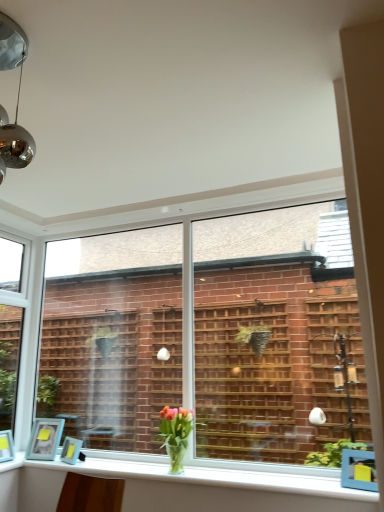
This screenshot has width=384, height=512. Describe the element at coordinates (12, 325) in the screenshot. I see `clear glass window at left, which appears as the 2th window when viewed from the right` at that location.

Describe the element at coordinates (180, 488) in the screenshot. I see `white glossy window sill at lower center` at that location.

In order to face matte blue picture frame at lower left, positioned as the second picture frame in right-to-left order, should I rotate leftwards or rightwards?

You should rotate left by 18.975 degrees.

The image size is (384, 512). Identify the location of matte blue picture frame at lower left, positioned as the 1th picture frame in right-to-left order. (71, 450).

Which of these two, matte blue picture frame at lower left, positioned as the 1th picture frame in right-to-left order, or translucent glass vase at lower center, is thinner?

With smaller width is matte blue picture frame at lower left, positioned as the 1th picture frame in right-to-left order.

Based on the photo, from a real-world perspective, between matte blue picture frame at lower left, positioned as the 1th picture frame in right-to-left order, and translucent glass vase at lower center, who is vertically lower?

matte blue picture frame at lower left, positioned as the 1th picture frame in right-to-left order, is physically lower.

Is the surface of matte blue picture frame at lower left, the 2th picture frame when ordered from left to right, in direct contact with translucent glass vase at lower center?

No, matte blue picture frame at lower left, the 2th picture frame when ordered from left to right, is not next to translucent glass vase at lower center.

Looking at this image, is translucent glass vase at lower center at the back of matte blue picture frame at lower left, positioned as the 1th picture frame in right-to-left order?

matte blue picture frame at lower left, positioned as the 1th picture frame in right-to-left order, does not have its back to translucent glass vase at lower center.

Is clear glass window at left, which appears as the 2th window when viewed from the right, not inside white glossy window sill at lower center?

clear glass window at left, which appears as the 2th window when viewed from the right, lies outside white glossy window sill at lower center's area.

From a real-world perspective, is clear glass window at left, which appears as the 2th window when viewed from the right, positioned above or below white glossy window sill at lower center?

From a real-world perspective, clear glass window at left, which appears as the 2th window when viewed from the right, is physically above white glossy window sill at lower center.

How many degrees apart are the facing directions of clear glass window at left, which appears as the 2th window when viewed from the right, and white glossy window sill at lower center?

There is a 89.6-degree angle between the facing directions of clear glass window at left, which appears as the 2th window when viewed from the right, and white glossy window sill at lower center.

From a real-world perspective, starting from the translucent glass vase at lower center, which window is the 2nd one vertically above it? Please provide its 2D coordinates.

[(12, 325)]

Is translucent glass vase at lower center in front of or behind clear glass window at left, which is the 1th window from left to right, in the image?

translucent glass vase at lower center is in front of clear glass window at left, which is the 1th window from left to right.

Looking at this image, is translucent glass vase at lower center taller than clear glass window at left, which appears as the 2th window when viewed from the right?

No, translucent glass vase at lower center is not taller than clear glass window at left, which appears as the 2th window when viewed from the right.

From the image's perspective, is translucent glass vase at lower center on top of clear glass window at left, which appears as the 2th window when viewed from the right?

No, from the image's perspective, translucent glass vase at lower center is not on top of clear glass window at left, which appears as the 2th window when viewed from the right.

Does clear glass window at center, arranged as the 2th window when viewed from the left, touch clear glass window at left, which appears as the 2th window when viewed from the right?

No, clear glass window at center, arranged as the 2th window when viewed from the left, is not beside clear glass window at left, which appears as the 2th window when viewed from the right.

Can you confirm if clear glass window at center, arranged as the 2th window when viewed from the left, is taller than clear glass window at left, which is the 1th window from left to right?

No, clear glass window at center, arranged as the 2th window when viewed from the left, is not taller than clear glass window at left, which is the 1th window from left to right.

From the image's perspective, does clear glass window at center, which appears as the 1th window when viewed from the right, appear higher than clear glass window at left, which is the 1th window from left to right?

Yes.

From a real-world perspective, is clear glass window at center, arranged as the 2th window when viewed from the left, positioned under clear glass window at left, which is the 1th window from left to right, based on gravity?

Correct, in the physical world, clear glass window at center, arranged as the 2th window when viewed from the left, is lower than clear glass window at left, which is the 1th window from left to right.

Is matte blue picture frame at lower left, positioned as the second picture frame in right-to-left order, next to clear glass window at left, which appears as the 2th window when viewed from the right, and touching it?

No, matte blue picture frame at lower left, positioned as the second picture frame in right-to-left order, is not next to clear glass window at left, which appears as the 2th window when viewed from the right.

Is matte blue picture frame at lower left, which is the 1th picture frame in left-to-right order, facing towards clear glass window at left, which appears as the 2th window when viewed from the right?

No, matte blue picture frame at lower left, which is the 1th picture frame in left-to-right order, does not turn towards clear glass window at left, which appears as the 2th window when viewed from the right.

Considering the sizes of objects matte blue picture frame at lower left, which is the 1th picture frame in left-to-right order, and clear glass window at left, which appears as the 2th window when viewed from the right, in the image provided, who is wider, matte blue picture frame at lower left, which is the 1th picture frame in left-to-right order, or clear glass window at left, which appears as the 2th window when viewed from the right,?

matte blue picture frame at lower left, which is the 1th picture frame in left-to-right order, is wider.

You are a GUI agent. You are given a task and a screenshot of the screen. Output one action in this format:
    pyautogui.click(x=<x>, y=<y>)
    Task: Click on the 1st window above when counting from the matte blue picture frame at lower left, positioned as the second picture frame in right-to-left order (from the image's perspective)
    Image resolution: width=384 pixels, height=512 pixels.
    Given the screenshot: What is the action you would take?
    pyautogui.click(x=12, y=325)

The image size is (384, 512). In order to click on picture frame below the matte blue picture frame at lower left, which is the 1th picture frame in left-to-right order (from the image's perspective) in this screenshot , I will do `click(71, 450)`.

Consider the image. In the image, is matte blue picture frame at lower left, positioned as the 1th picture frame in right-to-left order, positioned in front of or behind matte blue picture frame at lower left, which is the 1th picture frame in left-to-right order?

Clearly, matte blue picture frame at lower left, positioned as the 1th picture frame in right-to-left order, is in front of matte blue picture frame at lower left, which is the 1th picture frame in left-to-right order.

Is matte blue picture frame at lower left, the 2th picture frame when ordered from left to right, not within matte blue picture frame at lower left, positioned as the second picture frame in right-to-left order?

matte blue picture frame at lower left, the 2th picture frame when ordered from left to right, lies outside matte blue picture frame at lower left, positioned as the second picture frame in right-to-left order,'s area.

Considering the relative sizes of matte blue picture frame at lower left, positioned as the 1th picture frame in right-to-left order, and matte blue picture frame at lower left, which is the 1th picture frame in left-to-right order, in the image provided, is matte blue picture frame at lower left, positioned as the 1th picture frame in right-to-left order, taller than matte blue picture frame at lower left, which is the 1th picture frame in left-to-right order,?

In fact, matte blue picture frame at lower left, positioned as the 1th picture frame in right-to-left order, may be shorter than matte blue picture frame at lower left, which is the 1th picture frame in left-to-right order.

The width and height of the screenshot is (384, 512). What are the coordinates of `window sill directly beneath the clear glass window at center, arranged as the 2th window when viewed from the left (from a real-world perspective)` in the screenshot? It's located at (180, 488).

Is clear glass window at center, arranged as the 2th window when viewed from the left, aimed at white glossy window sill at lower center?

Yes, clear glass window at center, arranged as the 2th window when viewed from the left, is aimed at white glossy window sill at lower center.

Considering the sizes of objects clear glass window at center, arranged as the 2th window when viewed from the left, and white glossy window sill at lower center in the image provided, who is bigger, clear glass window at center, arranged as the 2th window when viewed from the left, or white glossy window sill at lower center?

With larger size is clear glass window at center, arranged as the 2th window when viewed from the left.

How different are the orientations of clear glass window at center, which appears as the 1th window when viewed from the right, and white glossy window sill at lower center in degrees?

There is a 0.459-degree angle between the facing directions of clear glass window at center, which appears as the 1th window when viewed from the right, and white glossy window sill at lower center.

Where is `houseplant positioned vertically above the matte blue picture frame at lower left, the 2th picture frame when ordered from left to right (from a real-world perspective)`? The height and width of the screenshot is (512, 384). houseplant positioned vertically above the matte blue picture frame at lower left, the 2th picture frame when ordered from left to right (from a real-world perspective) is located at coordinates click(175, 435).

This screenshot has width=384, height=512. Identify the location of window sill in front of the clear glass window at left, which is the 1th window from left to right. (180, 488).

From the image, which object appears to be farther from white glossy window sill at lower center, clear glass window at center, which appears as the 1th window when viewed from the right, or translucent glass vase at lower center?

Based on the image, clear glass window at center, which appears as the 1th window when viewed from the right, appears to be further to white glossy window sill at lower center.

Estimate the real-world distances between objects in this image. Which object is closer to white glossy window sill at lower center, matte blue picture frame at lower left, positioned as the second picture frame in right-to-left order, or translucent glass vase at lower center?

Based on the image, translucent glass vase at lower center appears to be nearer to white glossy window sill at lower center.

From the image, which object appears to be farther from clear glass window at left, which is the 1th window from left to right, white glossy window sill at lower center or matte blue picture frame at lower left, the 2th picture frame when ordered from left to right?

Among the two, white glossy window sill at lower center is located further to clear glass window at left, which is the 1th window from left to right.

Based on their spatial positions, is clear glass window at center, which appears as the 1th window when viewed from the right, or matte blue picture frame at lower left, positioned as the second picture frame in right-to-left order, further from matte blue picture frame at lower left, positioned as the 1th picture frame in right-to-left order?

The object further to matte blue picture frame at lower left, positioned as the 1th picture frame in right-to-left order, is clear glass window at center, which appears as the 1th window when viewed from the right.

Estimate the real-world distances between objects in this image. Which object is further from translucent glass vase at lower center, white glossy window sill at lower center or matte blue picture frame at lower left, positioned as the second picture frame in right-to-left order?

The object further to translucent glass vase at lower center is matte blue picture frame at lower left, positioned as the second picture frame in right-to-left order.

Which object lies nearer to the anchor point matte blue picture frame at lower left, positioned as the 1th picture frame in right-to-left order, translucent glass vase at lower center or matte blue picture frame at lower left, positioned as the second picture frame in right-to-left order?

matte blue picture frame at lower left, positioned as the second picture frame in right-to-left order, is positioned closer to the anchor matte blue picture frame at lower left, positioned as the 1th picture frame in right-to-left order.

Based on their spatial positions, is translucent glass vase at lower center or clear glass window at left, which appears as the 2th window when viewed from the right, further from white glossy window sill at lower center?

clear glass window at left, which appears as the 2th window when viewed from the right, lies further to white glossy window sill at lower center than the other object.

When comparing their distances from matte blue picture frame at lower left, positioned as the 1th picture frame in right-to-left order, does clear glass window at left, which appears as the 2th window when viewed from the right, or matte blue picture frame at lower left, positioned as the second picture frame in right-to-left order, seem closer?

matte blue picture frame at lower left, positioned as the second picture frame in right-to-left order.

This screenshot has height=512, width=384. In order to click on window sill situated between matte blue picture frame at lower left, the 2th picture frame when ordered from left to right, and translucent glass vase at lower center from left to right in this screenshot , I will do `click(180, 488)`.

Identify the location of houseplant that lies between clear glass window at center, which appears as the 1th window when viewed from the right, and white glossy window sill at lower center from top to bottom. (175, 435).

The image size is (384, 512). In order to click on picture frame between matte blue picture frame at lower left, positioned as the second picture frame in right-to-left order, and clear glass window at center, arranged as the 2th window when viewed from the left, in the horizontal direction in this screenshot , I will do `click(71, 450)`.

Where is `picture frame between clear glass window at left, which appears as the 2th window when viewed from the right, and matte blue picture frame at lower left, the 2th picture frame when ordered from left to right, in the up-down direction`? The height and width of the screenshot is (512, 384). picture frame between clear glass window at left, which appears as the 2th window when viewed from the right, and matte blue picture frame at lower left, the 2th picture frame when ordered from left to right, in the up-down direction is located at coordinates (45, 439).